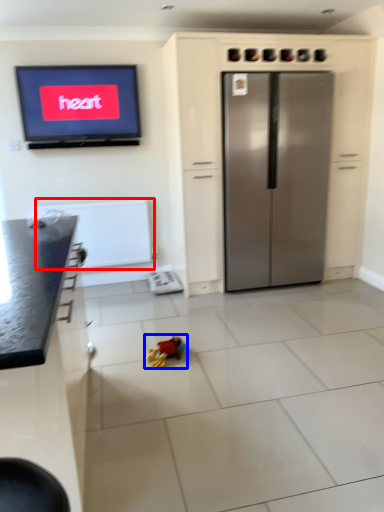
Question: Which object is further to the camera taking this photo, radiator (highlighted by a red box) or toy (highlighted by a blue box)?

Choices:
 (A) radiator
 (B) toy

Answer: (A)